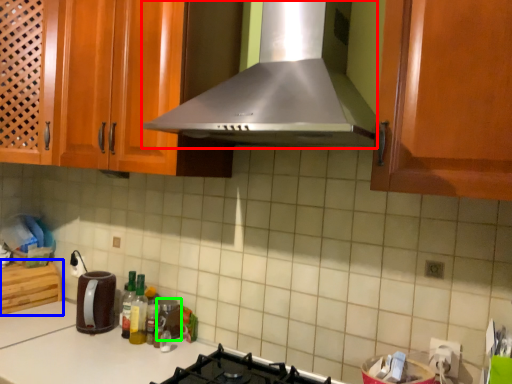
Question: Which object is the closest to the home appliance (highlighted by a red box)? Choose among these: cabinetry (highlighted by a blue box) or appliance (highlighted by a green box).

Choices:
 (A) cabinetry
 (B) appliance

Answer: (B)